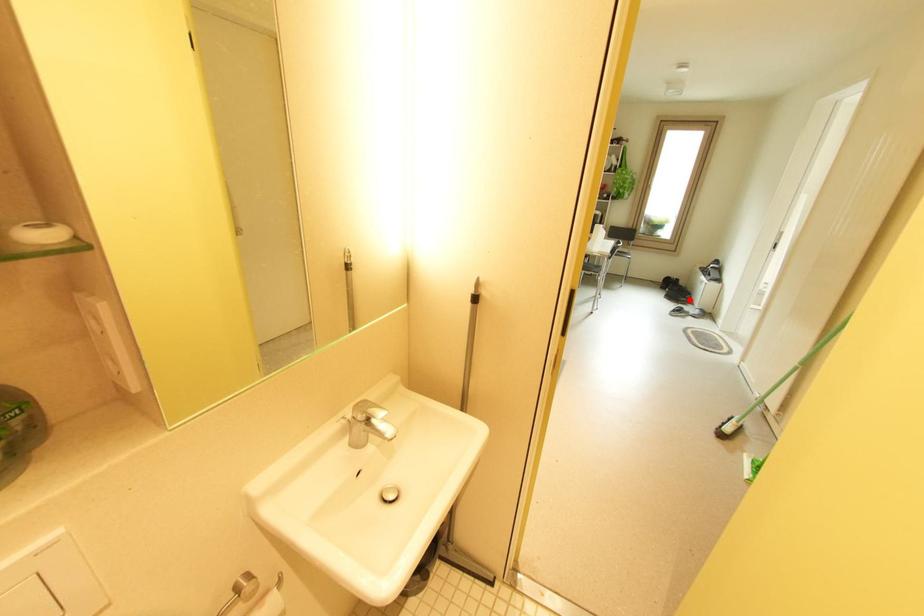
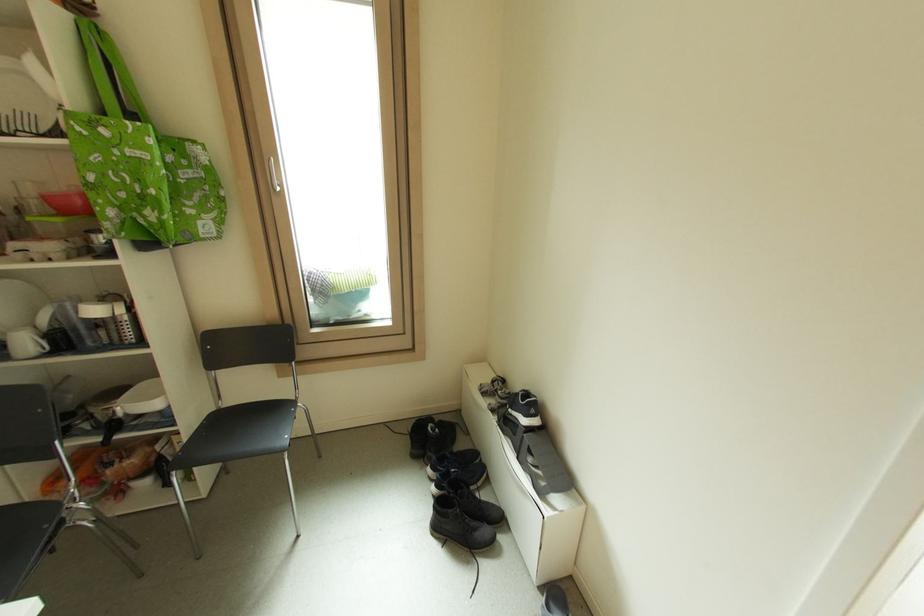
Question: I am providing you with two images of the same scene from different viewpoints. A red point is marked on the first image. At the location where the point appears in image 1, is it still visible in image 2?

Choices:
 (A) Yes
 (B) No

Answer: (A)